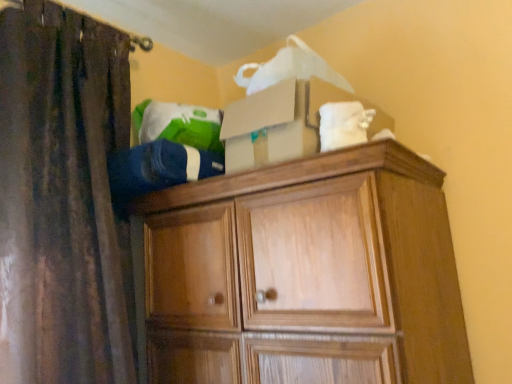
Question: Does white fabric at upper right, marked as the 1th clothing in a right-to-left arrangement, have a larger size compared to wooden cabinet at upper center?

Choices:
 (A) yes
 (B) no

Answer: (B)

Question: Could you tell me if white fabric at upper right, marked as the 1th clothing in a right-to-left arrangement, is turned towards wooden cabinet at upper center?

Choices:
 (A) yes
 (B) no

Answer: (B)

Question: Does white fabric at upper right, acting as the 2th clothing starting from the left, appear on the right side of wooden cabinet at upper center?

Choices:
 (A) yes
 (B) no

Answer: (A)

Question: Does white fabric at upper right, marked as the 1th clothing in a right-to-left arrangement, have a greater width compared to wooden cabinet at upper center?

Choices:
 (A) no
 (B) yes

Answer: (A)

Question: Is white fabric at upper right, acting as the 2th clothing starting from the left, thinner than wooden cabinet at upper center?

Choices:
 (A) no
 (B) yes

Answer: (B)

Question: Would you say wooden cabinet at upper center is to the left or to the right of brown fabric curtain at left in the picture?

Choices:
 (A) right
 (B) left

Answer: (A)

Question: In terms of height, does wooden cabinet at upper center look taller or shorter compared to brown fabric curtain at left?

Choices:
 (A) short
 (B) tall

Answer: (A)

Question: Considering the positions of wooden cabinet at upper center and brown fabric curtain at left in the image, is wooden cabinet at upper center bigger or smaller than brown fabric curtain at left?

Choices:
 (A) small
 (B) big

Answer: (B)

Question: Is wooden cabinet at upper center situated inside brown fabric curtain at left or outside?

Choices:
 (A) inside
 (B) outside

Answer: (B)

Question: In terms of height, does white fabric at upper right, marked as the 1th clothing in a right-to-left arrangement, look taller or shorter compared to blue fleece jacket at upper center, the 2th clothing when ordered from right to left?

Choices:
 (A) tall
 (B) short

Answer: (B)

Question: Is white fabric at upper right, marked as the 1th clothing in a right-to-left arrangement, inside the boundaries of blue fleece jacket at upper center, the 2th clothing when ordered from right to left, or outside?

Choices:
 (A) inside
 (B) outside

Answer: (B)

Question: Considering the positions of point (351, 115) and point (166, 185), is point (351, 115) closer or farther from the camera than point (166, 185)?

Choices:
 (A) farther
 (B) closer

Answer: (B)

Question: From a real-world perspective, relative to blue fleece jacket at upper center, the 1th clothing from the left, is white fabric at upper right, marked as the 1th clothing in a right-to-left arrangement, vertically above or below?

Choices:
 (A) below
 (B) above

Answer: (B)

Question: From a real-world perspective, is white fabric at upper right, marked as the 1th clothing in a right-to-left arrangement, above or below wooden cabinet at upper center?

Choices:
 (A) below
 (B) above

Answer: (B)

Question: From the image's perspective, is white fabric at upper right, acting as the 2th clothing starting from the left, located above or below wooden cabinet at upper center?

Choices:
 (A) above
 (B) below

Answer: (A)